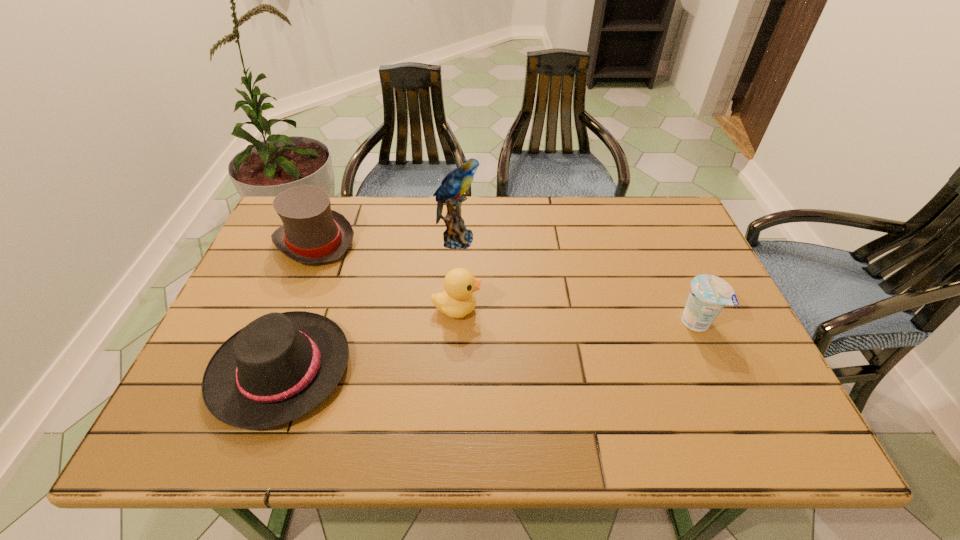
Find the location of `parrot`. parrot is located at coordinates (456, 236).

Locate an element on the screen. the taller dress hat is located at coordinates (312, 233).

I want to click on duck, so click(x=458, y=300).

At what (x,y) coordinates should I click in order to perform the action: click on yogurt. Please return your answer as a coordinate pair (x, y). The height and width of the screenshot is (540, 960). Looking at the image, I should click on (709, 294).

Where is `the nearer dress hat`? the nearer dress hat is located at coordinates (280, 366).

At what (x,y) coordinates should I click in order to perform the action: click on vacant space positioned on the face of the parrot. Please return your answer as a coordinate pair (x, y). Looking at the image, I should click on (566, 240).

Locate an element on the screen. free space located 0.370m on the right of the farther dress hat is located at coordinates (480, 241).

Where is `vacant space located on the face of the duck`? Image resolution: width=960 pixels, height=540 pixels. vacant space located on the face of the duck is located at coordinates (533, 309).

This screenshot has height=540, width=960. I want to click on vacant space situated on the left of the yogurt, so click(547, 322).

This screenshot has height=540, width=960. I want to click on free space located on the back of the shorter dress hat, so click(328, 244).